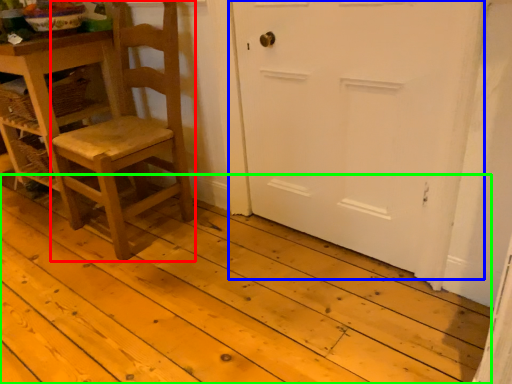
Question: Based on their relative distances, which object is nearer to chair (highlighted by a red box)? Choose from door (highlighted by a blue box) and plank (highlighted by a green box).

Choices:
 (A) door
 (B) plank

Answer: (B)